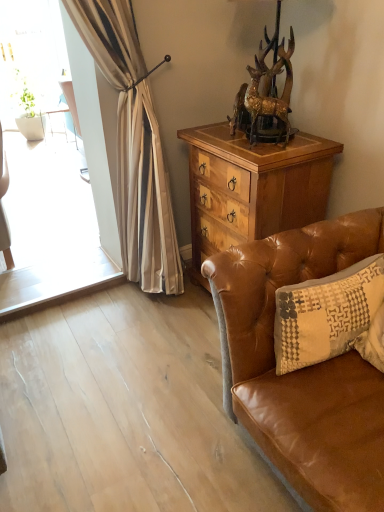
This screenshot has height=512, width=384. What do you see at coordinates (266, 96) in the screenshot? I see `gold metallic deer at upper center` at bounding box center [266, 96].

Describe the element at coordinates (252, 187) in the screenshot. I see `wooden cabinet at center` at that location.

Where is `gold metallic deer at upper center`? gold metallic deer at upper center is located at coordinates (266, 96).

Considering the points (249, 383) and (354, 271), which point is behind, point (249, 383) or point (354, 271)?

Positioned behind is point (354, 271).

This screenshot has width=384, height=512. In order to click on pillow located above the brown leather couch at lower right (from the image's perspective) in this screenshot , I will do `click(326, 314)`.

Does brown leather couch at lower right turn towards beige textured pillow at right?

Yes, brown leather couch at lower right is oriented towards beige textured pillow at right.

Is brown leather couch at lower right placed right next to beige textured pillow at right?

They are not placed beside each other.

Does beige textured pillow at right have a greater width compared to wooden cabinet at center?

No.

From a real-world perspective, which object stands above the other?

beige textured pillow at right, from a real-world perspective.

Is beige textured pillow at right located outside wooden cabinet at center?

Yes, beige textured pillow at right is located beyond the bounds of wooden cabinet at center.

Can you tell me how much beige textured pillow at right and wooden cabinet at center differ in facing direction?

87.5 degrees separate the facing orientations of beige textured pillow at right and wooden cabinet at center.

From the image's perspective, does gold metallic deer at upper center appear higher than beige textured pillow at right?

Yes, from the image's perspective, gold metallic deer at upper center is over beige textured pillow at right.

I want to click on pillow directly beneath the gold metallic deer at upper center (from a real-world perspective), so click(x=326, y=314).

Is gold metallic deer at upper center to the right of beige textured pillow at right from the viewer's perspective?

In fact, gold metallic deer at upper center is to the left of beige textured pillow at right.

Considering the relative positions of gold metallic deer at upper center and beige textured pillow at right in the image provided, is gold metallic deer at upper center behind beige textured pillow at right?

That is True.

Consider the image. Considering the sizes of objects brown leather couch at lower right and wooden cabinet at center in the image provided, who is smaller, brown leather couch at lower right or wooden cabinet at center?

Smaller between the two is wooden cabinet at center.

Is brown leather couch at lower right at the right side of wooden cabinet at center?

Correct, you'll find brown leather couch at lower right to the right of wooden cabinet at center.

Which of these two, brown leather couch at lower right or wooden cabinet at center, stands shorter?

With less height is brown leather couch at lower right.

Is beige textured pillow at right aimed at gold metallic deer at upper center?

No.

From the picture: Is beige textured pillow at right inside the boundaries of gold metallic deer at upper center, or outside?

beige textured pillow at right lies outside gold metallic deer at upper center.

Consider the image. How many degrees apart are the facing directions of beige textured pillow at right and gold metallic deer at upper center?

26.9 degrees separate the facing orientations of beige textured pillow at right and gold metallic deer at upper center.

Considering the relative sizes of beige textured pillow at right and gold metallic deer at upper center in the image provided, is beige textured pillow at right shorter than gold metallic deer at upper center?

No.

Between beige textured pillow at right and brown leather couch at lower right, which one has more height?

With more height is brown leather couch at lower right.

Would you consider beige textured pillow at right to be distant from brown leather couch at lower right?

No, beige textured pillow at right is not far from brown leather couch at lower right.

Which object is positioned more to the left, beige textured pillow at right or brown leather couch at lower right?

beige textured pillow at right.

Considering their positions, is beige textured pillow at right located in front of or behind brown leather couch at lower right?

In the image, beige textured pillow at right appears behind brown leather couch at lower right.

Looking at this image, what's the angular difference between gold metallic deer at upper center and brown leather couch at lower right's facing directions?

The angular difference between gold metallic deer at upper center and brown leather couch at lower right is 61.3 degrees.

From a real-world perspective, which is physically below, gold metallic deer at upper center or brown leather couch at lower right?

brown leather couch at lower right is physically lower.

Is brown leather couch at lower right surrounded by gold metallic deer at upper center?

Definitely not — brown leather couch at lower right is not inside gold metallic deer at upper center.

Which object is positioned more to the right, gold metallic deer at upper center or brown leather couch at lower right?

Positioned to the right is brown leather couch at lower right.

The image size is (384, 512). I want to click on pillow that is above the brown leather couch at lower right (from the image's perspective), so click(x=326, y=314).

Where is `pillow on the right of wooden cabinet at center`? The image size is (384, 512). pillow on the right of wooden cabinet at center is located at coordinates (326, 314).

Which object lies further to the anchor point brown leather couch at lower right, wooden cabinet at center or beige textured pillow at right?

wooden cabinet at center lies further to brown leather couch at lower right than the other object.

Based on the photo, based on their spatial positions, is beige textured pillow at right or gold metallic deer at upper center closer to brown leather couch at lower right?

beige textured pillow at right is positioned closer to the anchor brown leather couch at lower right.

When comparing their distances from wooden cabinet at center, does brown leather couch at lower right or beige textured pillow at right seem further?

The object further to wooden cabinet at center is beige textured pillow at right.

Based on their spatial positions, is gold metallic deer at upper center or wooden cabinet at center further from beige textured pillow at right?

gold metallic deer at upper center lies further to beige textured pillow at right than the other object.

Which object lies further to the anchor point gold metallic deer at upper center, wooden cabinet at center or beige textured pillow at right?

beige textured pillow at right.

From the image, which object appears to be farther from beige textured pillow at right, wooden cabinet at center or gold metallic deer at upper center?

gold metallic deer at upper center.

In the scene shown: Which object lies nearer to the anchor point brown leather couch at lower right, wooden cabinet at center or gold metallic deer at upper center?

The object closer to brown leather couch at lower right is wooden cabinet at center.

From the picture: Estimate the real-world distances between objects in this image. Which object is closer to beige textured pillow at right, brown leather couch at lower right or gold metallic deer at upper center?

A: The object closer to beige textured pillow at right is brown leather couch at lower right.

Locate an element on the screen. animal located between brown leather couch at lower right and wooden cabinet at center in the depth direction is located at coordinates (266, 96).

This screenshot has width=384, height=512. Identify the location of cabinetry that lies between gold metallic deer at upper center and beige textured pillow at right from top to bottom. (252, 187).

Where is `pillow between gold metallic deer at upper center and brown leather couch at lower right in the vertical direction`? The height and width of the screenshot is (512, 384). pillow between gold metallic deer at upper center and brown leather couch at lower right in the vertical direction is located at coordinates (326, 314).

The width and height of the screenshot is (384, 512). I want to click on pillow positioned between brown leather couch at lower right and wooden cabinet at center from near to far, so pyautogui.click(x=326, y=314).